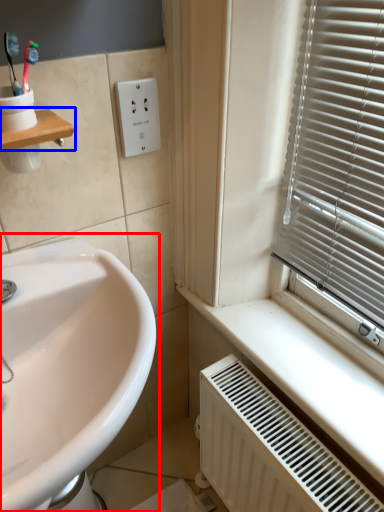
Question: Which point is further to the camera, sink (highlighted by a red box) or window sill (highlighted by a blue box)?

Choices:
 (A) sink
 (B) window sill

Answer: (B)